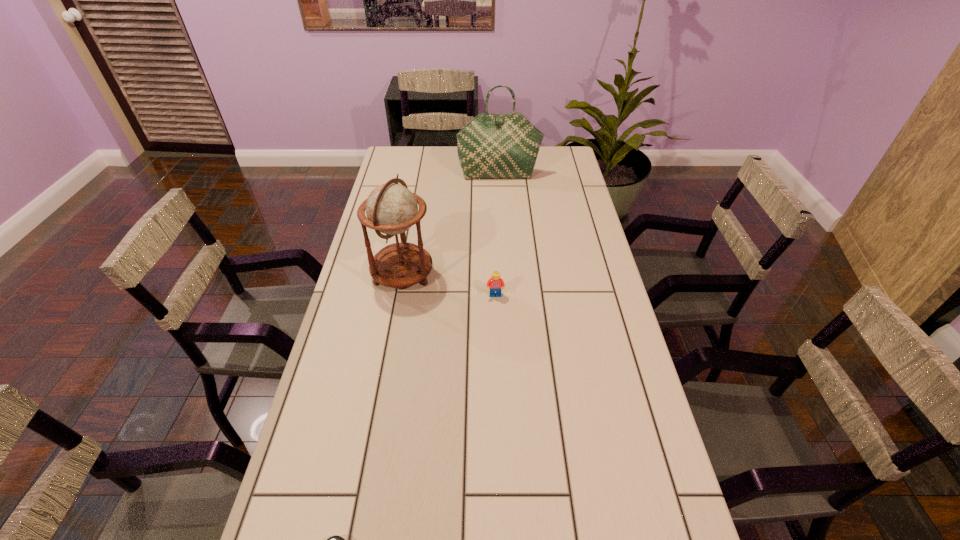
Identify the location of object that is the closest to the remote control. Image resolution: width=960 pixels, height=540 pixels. (391, 208).

At what (x,y) coordinates should I click in order to perform the action: click on object that is the third closest to the farthest object. Please return your answer as a coordinate pair (x, y). Image resolution: width=960 pixels, height=540 pixels. Looking at the image, I should click on (336, 539).

You are a GUI agent. You are given a task and a screenshot of the screen. Output one action in this format:
    pyautogui.click(x=<x>, y=<y>)
    Task: Click on the free location that satisfies the following two spatial constraints: 1. on the front side of the farthest object; 2. on the surface of the globe
    
    Given the screenshot: What is the action you would take?
    pyautogui.click(x=505, y=275)